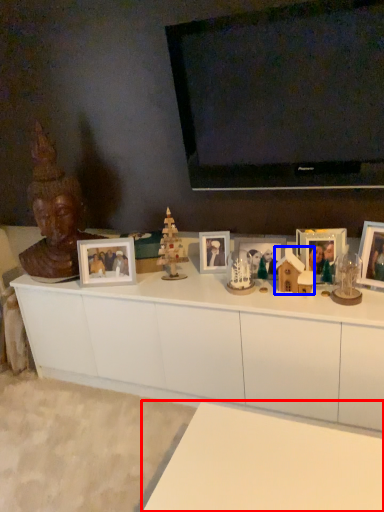
Question: Which object is closer to the camera taking this photo, table (highlighted by a red box) or toy (highlighted by a blue box)?

Choices:
 (A) table
 (B) toy

Answer: (A)